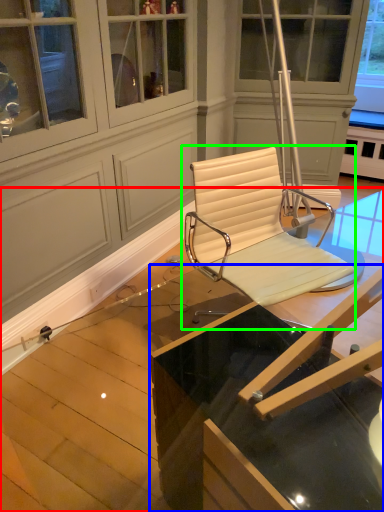
Question: Which is farther away from table (highlighted by a red box)? table (highlighted by a blue box) or chair (highlighted by a green box)?

Choices:
 (A) table
 (B) chair

Answer: (A)